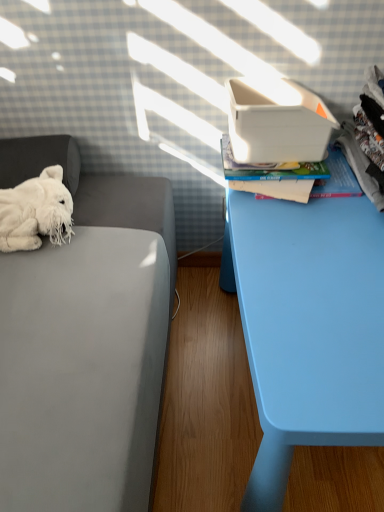
Question: Would you say light blue plastic table at right is to the left or to the right of white plush toy at left in the picture?

Choices:
 (A) right
 (B) left

Answer: (A)

Question: From the image's perspective, relative to white plush toy at left, is light blue plastic table at right above or below?

Choices:
 (A) above
 (B) below

Answer: (B)

Question: Estimate the real-world distances between objects in this image. Which object is farther from the white plastic shoe box at upper right?

Choices:
 (A) white fluffy stuffed animal at left
 (B) white plush toy at left
 (C) light blue plastic table at right
 (D) hardcover book at upper right

Answer: (A)

Question: Which object is the closest to the white plush toy at left?

Choices:
 (A) hardcover book at upper right
 (B) white fluffy stuffed animal at left
 (C) white plastic shoe box at upper right
 (D) light blue plastic table at right

Answer: (B)